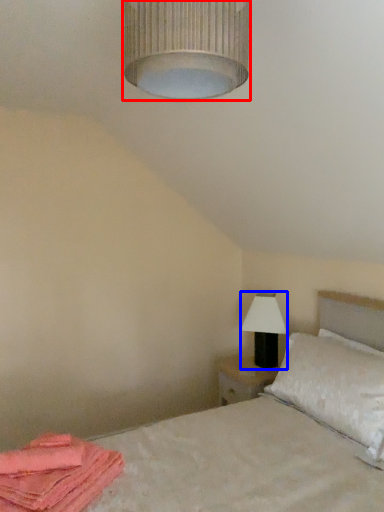
Question: Which object is further to the camera taking this photo, lamp (highlighted by a red box) or table lamp (highlighted by a blue box)?

Choices:
 (A) lamp
 (B) table lamp

Answer: (B)